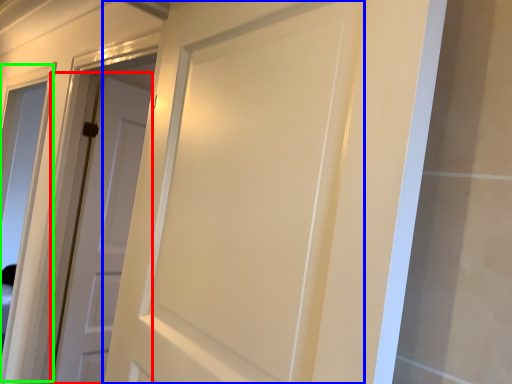
Question: Considering the real-world distances, which object is closest to door (highlighted by a red box)? door (highlighted by a blue box) or window (highlighted by a green box).

Choices:
 (A) door
 (B) window

Answer: (A)